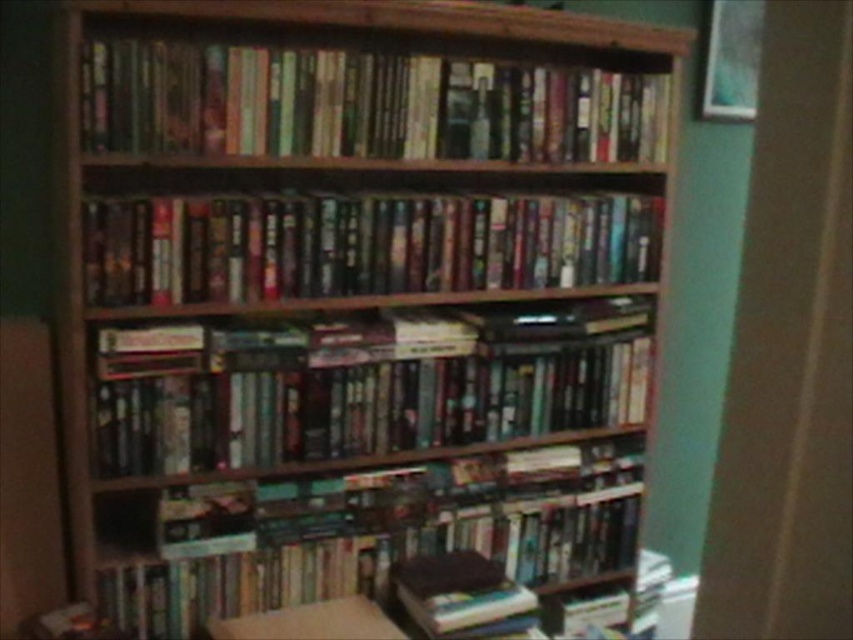
In the scene shown: You are organizing books on a wooden bookshelf. You have two sets of books to place. The first set is the hardcover books at upper center and the second set is the hardcover books at center. Which set of books requires a larger space when placing them on the shelf?

The hardcover books at upper center requires a larger space when placing them on the shelf because they are bigger than the hardcover books at center.

You are organizing books on a wooden bookshelf and notice two types of books at the center. Which type of book, the hardcover books at center or the shiny plastic books at center, would you need to place on a higher shelf to avoid them overlapping?

The hardcover books at center are taller than the shiny plastic books at center, so you should place the hardcover books at center on a higher shelf to avoid overlapping.